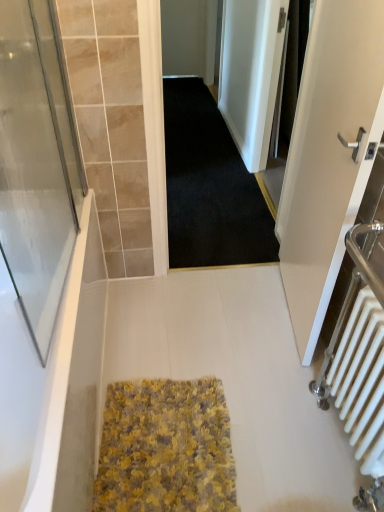
Question: Does white matte door at right lie behind yellow textured rug at center?

Choices:
 (A) yes
 (B) no

Answer: (B)

Question: Is white matte door at right touching yellow textured rug at center?

Choices:
 (A) yes
 (B) no

Answer: (B)

Question: Is white matte door at right far from yellow textured rug at center?

Choices:
 (A) no
 (B) yes

Answer: (A)

Question: Is white matte door at right bigger than yellow textured rug at center?

Choices:
 (A) no
 (B) yes

Answer: (B)

Question: Is yellow textured rug at center surrounded by white matte door at right?

Choices:
 (A) yes
 (B) no

Answer: (B)

Question: From the image's perspective, is transparent glass screen door at left, the 1th screen door positioned from the bottom, located above or below white metallic radiator at right?

Choices:
 (A) below
 (B) above

Answer: (B)

Question: Looking at their shapes, would you say transparent glass screen door at left, the second screen door positioned from the back, is wider or thinner than white metallic radiator at right?

Choices:
 (A) thin
 (B) wide

Answer: (A)

Question: Considering the positions of transparent glass screen door at left, placed as the first screen door when sorted from left to right, and white metallic radiator at right in the image, is transparent glass screen door at left, placed as the first screen door when sorted from left to right, taller or shorter than white metallic radiator at right?

Choices:
 (A) tall
 (B) short

Answer: (B)

Question: Considering their positions, is transparent glass screen door at left, the 1th screen door positioned from the bottom, located in front of or behind white metallic radiator at right?

Choices:
 (A) front
 (B) behind

Answer: (A)

Question: Considering their positions, is black fabric screen door at upper right, the 1th screen door from the top, located in front of or behind white glossy bathtub at lower left?

Choices:
 (A) front
 (B) behind

Answer: (B)

Question: Is black fabric screen door at upper right, which ranks as the second screen door in left-to-right order, spatially inside white glossy bathtub at lower left, or outside of it?

Choices:
 (A) outside
 (B) inside

Answer: (A)

Question: From the image's perspective, is black fabric screen door at upper right, the 1th screen door from the top, positioned above or below white glossy bathtub at lower left?

Choices:
 (A) above
 (B) below

Answer: (A)

Question: From their relative heights in the image, would you say black fabric screen door at upper right, the first screen door in the back-to-front sequence, is taller or shorter than white glossy bathtub at lower left?

Choices:
 (A) tall
 (B) short

Answer: (A)

Question: Looking at the image, does white metallic radiator at right seem bigger or smaller compared to yellow textured rug at center?

Choices:
 (A) small
 (B) big

Answer: (B)

Question: Is point [x=349, y=348] positioned closer to the camera than point [x=104, y=471]?

Choices:
 (A) farther
 (B) closer

Answer: (B)